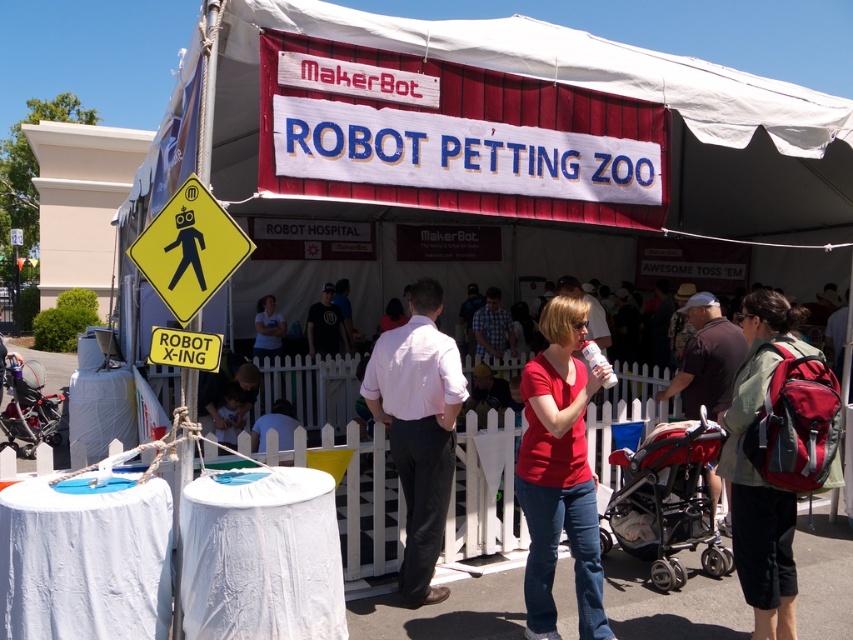
You are attending the MakerBot ROBOT PETTING ZOO event and notice two people wearing a matte red shirt at center and a dark blue shirt at center. From your perspective at the entrance, which shirt color is closer to you?

The matte red shirt at center is closer to you because it is in front of the dark blue shirt at center.